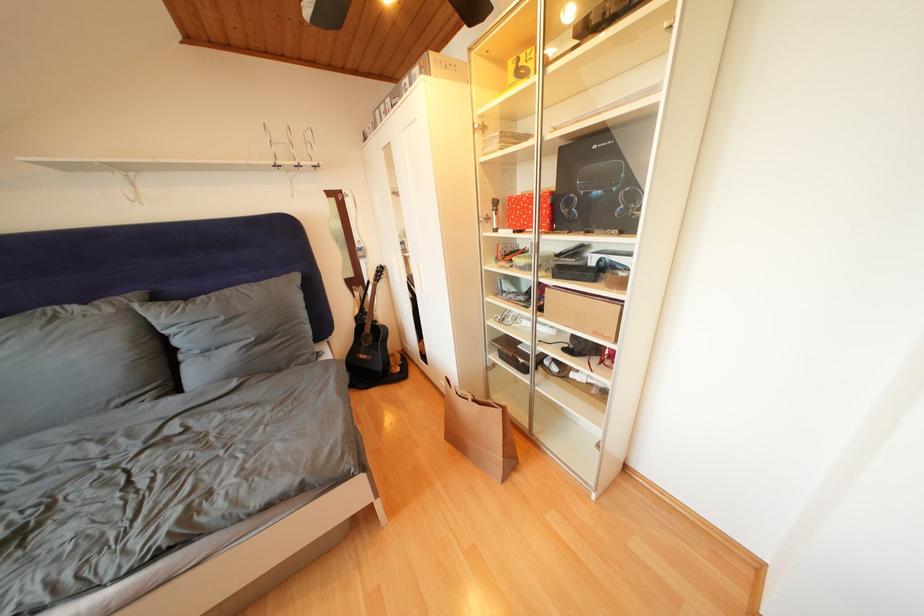
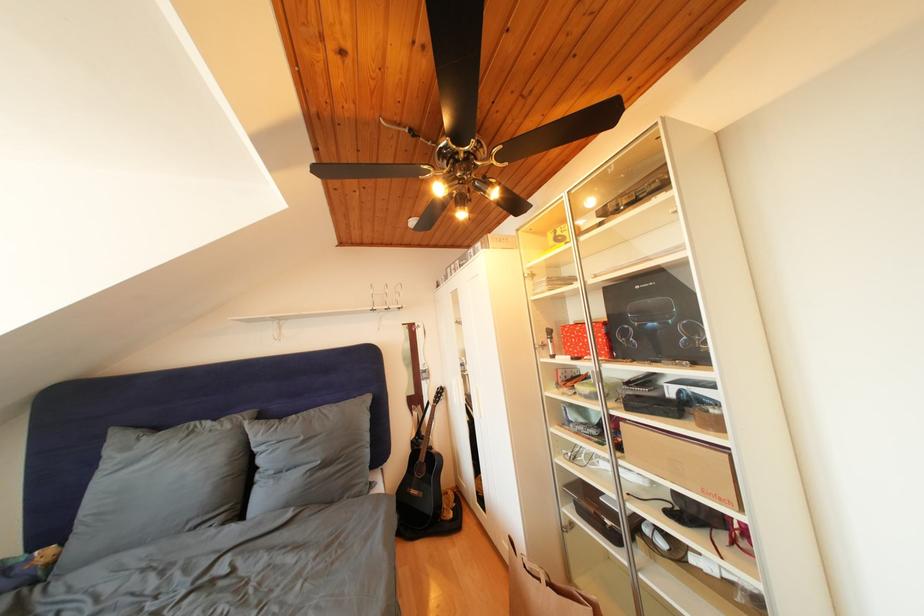
Locate, in the second image, the point that corresponds to (x=546, y=318) in the first image.

(626, 459)